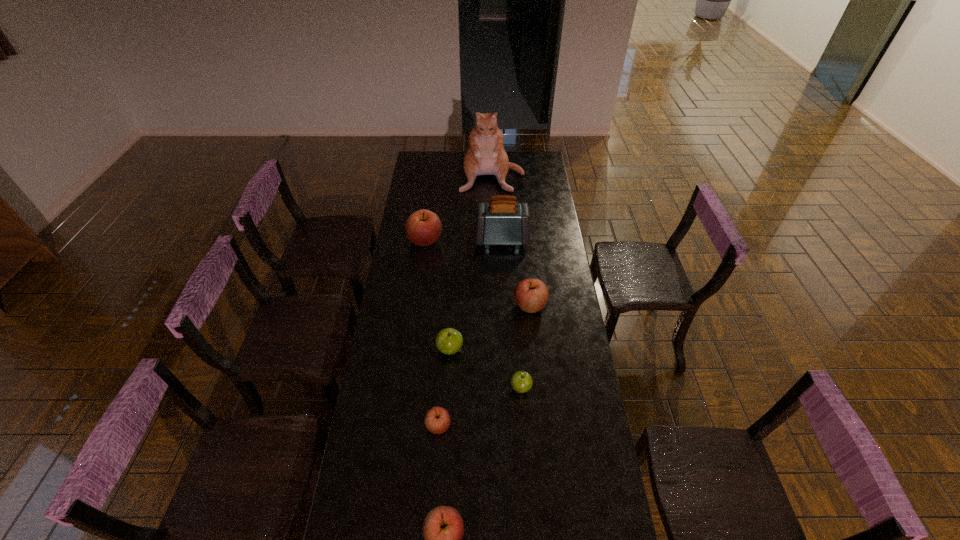
Locate which red apple is the second closest to the rightmost red apple. Please provide its 2D coordinates. Your answer should be formatted as a tuple, i.e. [(x, y)], where the tuple contains the x and y coordinates of a point satisfying the conditions above.

[(437, 420)]

You are a GUI agent. You are given a task and a screenshot of the screen. Output one action in this format:
    pyautogui.click(x=<x>, y=<y>)
    Task: Click on the vacant area that satisfies the following two spatial constraints: 1. on the face of the cat; 2. on the left side of the fifth nearest object
    
    Given the screenshot: What is the action you would take?
    pyautogui.click(x=496, y=306)

I want to click on vacant space that satisfies the following two spatial constraints: 1. on the back side of the nearer green apple; 2. on the front-facing side of the toaster, so click(510, 240).